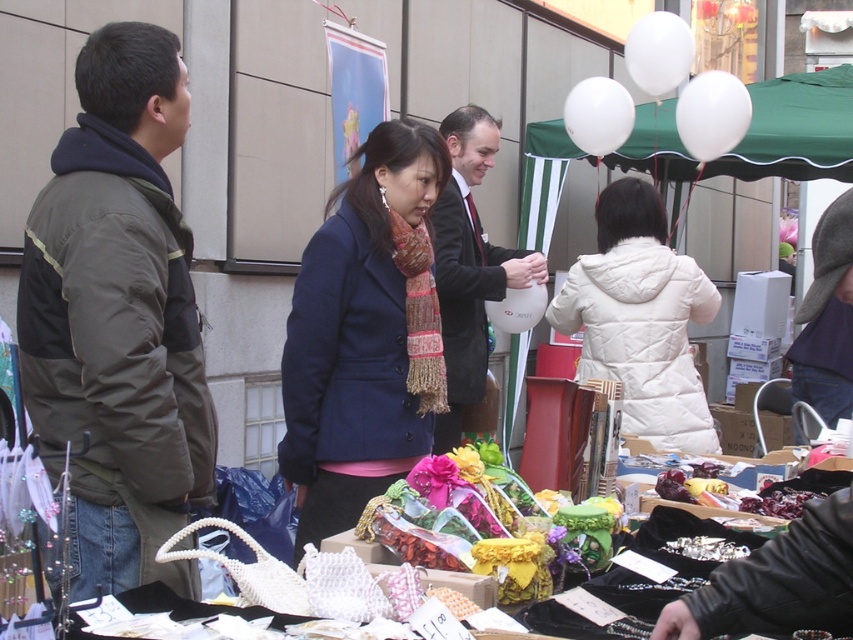
Does dark green jacket at left have a smaller size compared to black suit at center?

Yes.

Which of these two, dark green jacket at left or black suit at center, stands shorter?

With less height is dark green jacket at left.

Which is in front, point (131, 72) or point (465, 172)?

Point (131, 72)

Find the location of `dark green jacket at left`. dark green jacket at left is located at coordinates pyautogui.click(x=119, y=317).

Based on the photo, who is taller, green fabric canopy at upper center or black suit at center?

Standing taller between the two is black suit at center.

Between green fabric canopy at upper center and black suit at center, which one appears on the left side from the viewer's perspective?

Positioned to the left is black suit at center.

You are a GUI agent. You are given a task and a screenshot of the screen. Output one action in this format:
    pyautogui.click(x=<x>, y=<y>)
    Task: Click on the green fabric canopy at upper center
    
    Given the screenshot: What is the action you would take?
    click(795, 129)

Which is more to the left, black suit at center or knitted wool scarf at center?

knitted wool scarf at center

Between black suit at center and knitted wool scarf at center, which one has less height?

knitted wool scarf at center is shorter.

Who is more forward, (469,243) or (431,384)?

Point (431,384) is more forward.

Find the location of a particular element. black suit at center is located at coordinates 469,268.